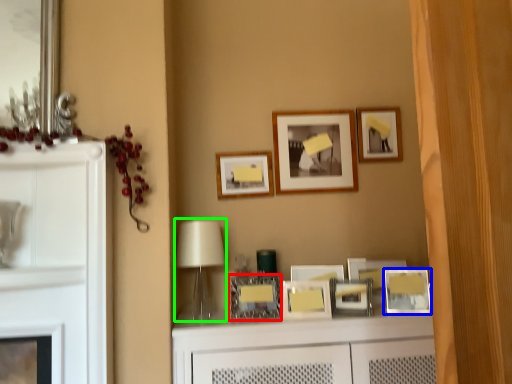
Question: Which object is positioned closest to picture frame (highlighted by a red box)? Select from picture frame (highlighted by a blue box) and table lamp (highlighted by a green box).

Choices:
 (A) picture frame
 (B) table lamp

Answer: (B)